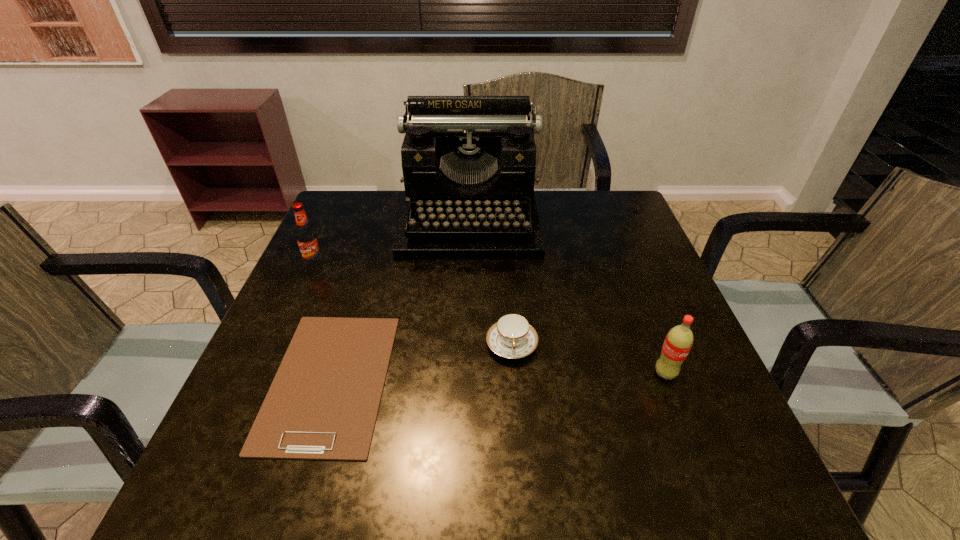
Find the location of `the farthest object`. the farthest object is located at coordinates (468, 162).

This screenshot has width=960, height=540. I want to click on the tallest object, so click(x=468, y=162).

The image size is (960, 540). What are the coordinates of `the fourth nearest object` in the screenshot? It's located at (306, 236).

The height and width of the screenshot is (540, 960). Identify the location of the rightmost object. (679, 340).

The width and height of the screenshot is (960, 540). Find the location of `teacup`. teacup is located at coordinates (512, 336).

You are a GUI agent. You are given a task and a screenshot of the screen. Output one action in this format:
    pyautogui.click(x=<x>, y=<y>)
    Task: Click on the clipboard
    This screenshot has height=540, width=960.
    Given the screenshot: What is the action you would take?
    pyautogui.click(x=323, y=403)

Locate an element on the screen. The height and width of the screenshot is (540, 960). free region located on the typing side of the typewriter is located at coordinates (468, 274).

Locate an element on the screen. The width and height of the screenshot is (960, 540). vacant space situated 0.270m on the back of the root beer is located at coordinates (343, 201).

Image resolution: width=960 pixels, height=540 pixels. I want to click on free space located on the front of the soda, so click(x=678, y=407).

Identify the location of blank space located 0.240m on the side with the handle of the teacup. The height and width of the screenshot is (540, 960). (522, 491).